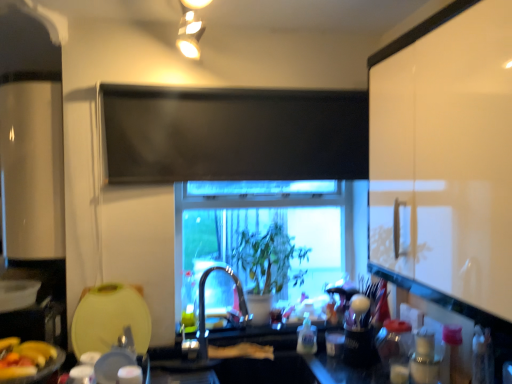
Question: Would you say transparent glass window at center contains green matte plant at center?

Choices:
 (A) yes
 (B) no

Answer: (A)

Question: From a real-world perspective, is transparent glass window at center below green matte plant at center?

Choices:
 (A) yes
 (B) no

Answer: (B)

Question: Does transparent glass window at center have a greater width compared to green matte plant at center?

Choices:
 (A) no
 (B) yes

Answer: (B)

Question: Does transparent glass window at center have a larger size compared to green matte plant at center?

Choices:
 (A) yes
 (B) no

Answer: (A)

Question: Is transparent glass window at center shorter than green matte plant at center?

Choices:
 (A) no
 (B) yes

Answer: (A)

Question: Does point (3, 365) appear closer or farther from the camera than point (242, 292)?

Choices:
 (A) closer
 (B) farther

Answer: (A)

Question: Is yellow matte bananas at lower left wider or thinner than satin nickel faucet at center?

Choices:
 (A) thin
 (B) wide

Answer: (B)

Question: From a real-world perspective, is yellow matte bananas at lower left physically located above or below satin nickel faucet at center?

Choices:
 (A) below
 (B) above

Answer: (A)

Question: Based on their positions, is yellow matte bananas at lower left located to the left or right of satin nickel faucet at center?

Choices:
 (A) left
 (B) right

Answer: (A)

Question: Choose the correct answer: Is translucent plastic bottle at center, the 2th bottle when ordered from front to back, inside matte gold light fixture at upper center or outside it?

Choices:
 (A) inside
 (B) outside

Answer: (B)

Question: From a real-world perspective, is translucent plastic bottle at center, the 2th bottle when ordered from front to back, above or below matte gold light fixture at upper center?

Choices:
 (A) above
 (B) below

Answer: (B)

Question: Considering the positions of translucent plastic bottle at center, the 2th bottle when ordered from front to back, and matte gold light fixture at upper center in the image, is translucent plastic bottle at center, the 2th bottle when ordered from front to back, bigger or smaller than matte gold light fixture at upper center?

Choices:
 (A) big
 (B) small

Answer: (B)

Question: Is translucent plastic bottle at center, the 2th bottle in the right-to-left sequence, wider or thinner than matte gold light fixture at upper center?

Choices:
 (A) wide
 (B) thin

Answer: (B)

Question: Is white glossy cabinet at right taller or shorter than translucent plastic bottle at center, the 2th bottle when ordered from front to back?

Choices:
 (A) tall
 (B) short

Answer: (A)

Question: From a real-world perspective, is white glossy cabinet at right physically located above or below translucent plastic bottle at center, which is the first bottle from back to front?

Choices:
 (A) below
 (B) above

Answer: (B)